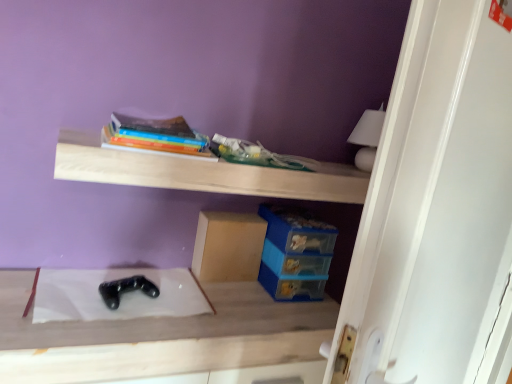
The height and width of the screenshot is (384, 512). What do you see at coordinates (228, 247) in the screenshot? I see `matte cardboard box at center` at bounding box center [228, 247].

This screenshot has width=512, height=384. What are the coordinates of `hardcover book at upper center` in the screenshot? It's located at (156, 136).

The width and height of the screenshot is (512, 384). What do you see at coordinates (436, 210) in the screenshot? I see `white glossy door at upper right` at bounding box center [436, 210].

This screenshot has height=384, width=512. Describe the element at coordinates (126, 289) in the screenshot. I see `black matte game controller at lower center` at that location.

Where is `matte cardboard box at center`? matte cardboard box at center is located at coordinates (228, 247).

From a real-world perspective, is matte cardboard box at center below hardcover book at upper center?

Yes.

Is matte cardboard box at center aimed at hardcover book at upper center?

No, matte cardboard box at center is not oriented towards hardcover book at upper center.

Between matte cardboard box at center and hardcover book at upper center, which one has less height?

Standing shorter between the two is hardcover book at upper center.

Considering the relative positions of matte cardboard box at center and hardcover book at upper center in the image provided, is matte cardboard box at center to the left or to the right of hardcover book at upper center?

Based on their positions, matte cardboard box at center is located to the right of hardcover book at upper center.

Can you confirm if wooden shelf at upper center is shorter than black matte game controller at lower center?

In fact, wooden shelf at upper center may be taller than black matte game controller at lower center.

From a real-world perspective, relative to black matte game controller at lower center, is wooden shelf at upper center vertically above or below?

In terms of real-world spatial position, wooden shelf at upper center is above black matte game controller at lower center.

Between wooden shelf at upper center and black matte game controller at lower center, which one appears on the left side from the viewer's perspective?

From the viewer's perspective, black matte game controller at lower center appears more on the left side.

Is white glossy door at upper right at the back of wooden shelf at upper center?

No, wooden shelf at upper center is not facing the opposite direction of white glossy door at upper right.

Which is closer to the camera, (84, 176) or (497, 146)?

A: Point (84, 176).

Is wooden shelf at upper center next to white glossy door at upper right and touching it?

There is a gap between wooden shelf at upper center and white glossy door at upper right.

How different are the orientations of wooden shelf at upper center and white glossy door at upper right in degrees?

wooden shelf at upper center and white glossy door at upper right are facing 16.6 degrees away from each other.

Is wooden shelf at upper center thinner than black matte game controller at center?

Correct, the width of wooden shelf at upper center is less than that of black matte game controller at center.

Is black matte game controller at center completely or partially inside wooden shelf at upper center?

No, black matte game controller at center is not a part of wooden shelf at upper center.

Considering the sizes of objects wooden shelf at upper center and black matte game controller at center in the image provided, who is taller, wooden shelf at upper center or black matte game controller at center?

black matte game controller at center.

Which is more to the right, wooden shelf at upper center or black matte game controller at center?

From the viewer's perspective, wooden shelf at upper center appears more on the right side.

Is black matte game controller at center looking in the opposite direction of black matte game controller at lower center?

No, black matte game controller at center is not facing away from black matte game controller at lower center.

Considering the sizes of objects black matte game controller at center and black matte game controller at lower center in the image provided, who is smaller, black matte game controller at center or black matte game controller at lower center?

black matte game controller at lower center.

Can you confirm if black matte game controller at center is wider than black matte game controller at lower center?

Yes, black matte game controller at center is wider than black matte game controller at lower center.

From the image's perspective, is white glossy door at upper right positioned above or below hardcover book at upper center?

white glossy door at upper right is situated lower than hardcover book at upper center in the image.

Considering the relative sizes of white glossy door at upper right and hardcover book at upper center in the image provided, is white glossy door at upper right taller than hardcover book at upper center?

Correct, white glossy door at upper right is much taller as hardcover book at upper center.

Where is `door on the right of hardcover book at upper center`? Image resolution: width=512 pixels, height=384 pixels. door on the right of hardcover book at upper center is located at coordinates (436, 210).

Looking at this image, is white glossy door at upper right aimed at hardcover book at upper center?

No, white glossy door at upper right is not facing towards hardcover book at upper center.

Can you confirm if black matte game controller at center is bigger than matte cardboard box at center?

Yes, black matte game controller at center is bigger than matte cardboard box at center.

Is black matte game controller at center to the left of matte cardboard box at center from the viewer's perspective?

Yes.

What are the coordinates of `table located in front of the matte cardboard box at center` in the screenshot? It's located at point(159,337).

In the scene shown: Is black matte game controller at center aimed at matte cardboard box at center?

No, black matte game controller at center does not turn towards matte cardboard box at center.

Image resolution: width=512 pixels, height=384 pixels. Find the location of `cardboard box that is on the right side of hardcover book at upper center`. cardboard box that is on the right side of hardcover book at upper center is located at coordinates (228, 247).

Find the location of `shoe behind the wooden shelf at upper center`. shoe behind the wooden shelf at upper center is located at coordinates (126, 289).

In the scene shown: Looking at the image, which one is located further to matte cardboard box at center, black matte game controller at center or wooden shelf at upper center?

wooden shelf at upper center is positioned further to the anchor matte cardboard box at center.

Based on their spatial positions, is matte cardboard box at center or black matte game controller at center closer to black matte game controller at lower center?

The object closer to black matte game controller at lower center is black matte game controller at center.

From the picture: From the image, which object appears to be farther from matte cardboard box at center, white glossy door at upper right or wooden shelf at upper center?

white glossy door at upper right is further to matte cardboard box at center.

Considering their positions, is white glossy door at upper right positioned closer to wooden shelf at upper center than black matte game controller at lower center?

The object closer to wooden shelf at upper center is black matte game controller at lower center.

Estimate the real-world distances between objects in this image. Which object is closer to white glossy door at upper right, hardcover book at upper center or black matte game controller at center?

Among the two, black matte game controller at center is located nearer to white glossy door at upper right.

Which object lies nearer to the anchor point black matte game controller at lower center, hardcover book at upper center or white glossy door at upper right?

hardcover book at upper center is closer to black matte game controller at lower center.

Which object lies nearer to the anchor point black matte game controller at center, hardcover book at upper center or white glossy door at upper right?

hardcover book at upper center is positioned closer to the anchor black matte game controller at center.

Estimate the real-world distances between objects in this image. Which object is further from white glossy door at upper right, black matte game controller at center or hardcover book at upper center?

hardcover book at upper center.

The width and height of the screenshot is (512, 384). Identify the location of book between white glossy door at upper right and matte cardboard box at center from front to back. (156, 136).

Find the location of a particular element. The image size is (512, 384). shelf between white glossy door at upper right and matte cardboard box at center along the z-axis is located at coordinates (201, 173).

Identify the location of table between black matte game controller at lower center and white glossy door at upper right. (159, 337).

This screenshot has height=384, width=512. In order to click on table situated between hardcover book at upper center and white glossy door at upper right from left to right in this screenshot , I will do `click(159, 337)`.